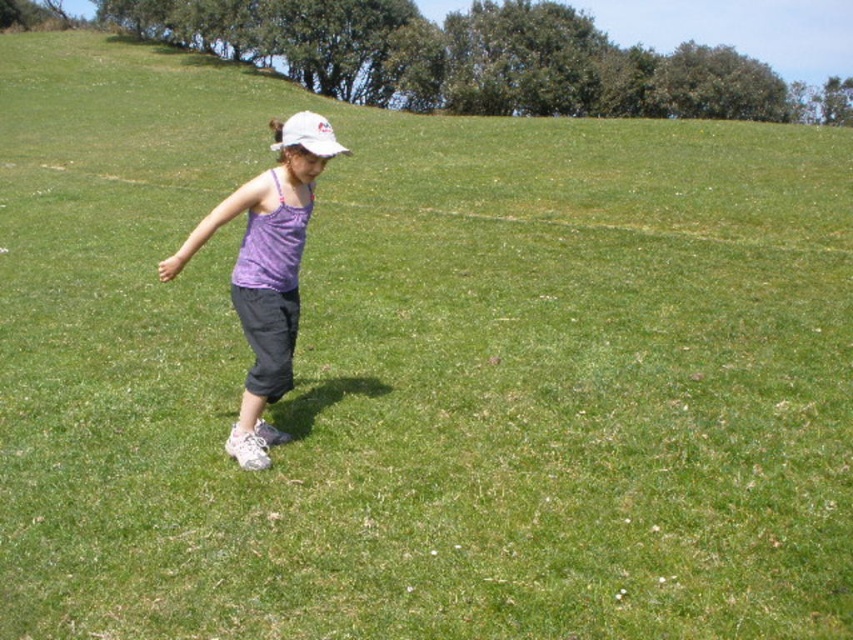
The young girl in the image is wearing two items at the center of the scene. Which item is closer to the viewer between the purple fabric tank top at center and the white matte baseball hat at center?

The purple fabric tank top at center is in front of the white matte baseball hat at center, so it is closer to the viewer.

You are a photographer trying to capture the girl in the image. You want to ensure that both the purple fabric tank top at center and the white matte baseball hat at center are clearly visible in your photo. Given that your camera has a minimum focus distance of 4 meters, will you be able to focus on both objects simultaneously?

The purple fabric tank top at center is 4.44 meters from the white matte baseball hat at center. Since the distance between them is greater than the camera minimum focus distance of 4 meters, the camera can focus on both objects simultaneously.